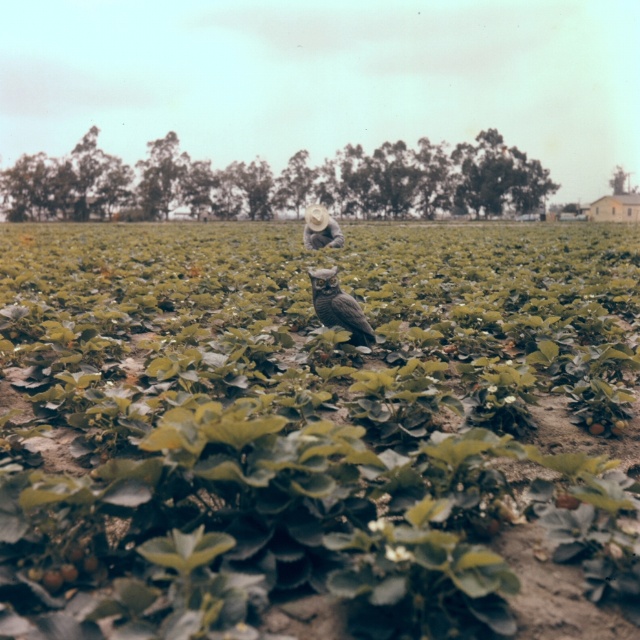
Who is more forward, (122, 289) or (368, 340)?

Point (368, 340) is in front.

Find the location of a particular element. green matte plant at center is located at coordinates pos(307,422).

Does green matte plant at center appear over light brown straw hat at center?

No, green matte plant at center is not above light brown straw hat at center.

Does point (372, 244) lie behind point (307, 205)?

That is True.

Who is more forward, (x=461, y=364) or (x=305, y=216)?

Point (x=461, y=364) is in front.

Where is `green matte plant at center`? The height and width of the screenshot is (640, 640). green matte plant at center is located at coordinates (307, 422).

Does brown feathered owl at center have a greater width compared to light brown straw hat at center?

Incorrect, brown feathered owl at center's width does not surpass light brown straw hat at center's.

The height and width of the screenshot is (640, 640). Find the location of `brown feathered owl at center`. brown feathered owl at center is located at coordinates (339, 307).

Does point (349, 340) lie behind point (332, 237)?

That is False.

Image resolution: width=640 pixels, height=640 pixels. Identify the location of brown feathered owl at center. (339, 307).